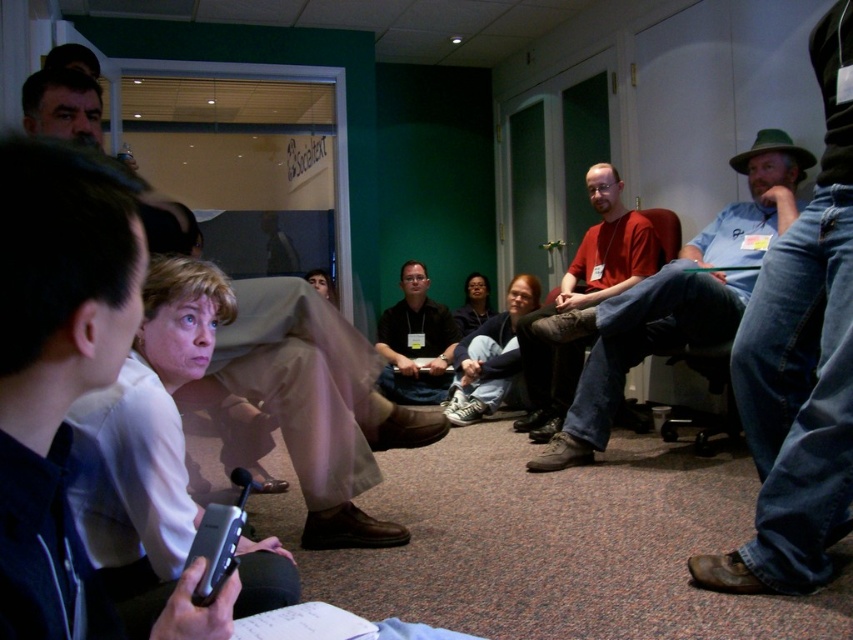
You are an attendee in the conference room and want to see the presenter at the front. Which attendee should you look past, the white fabric shirt at upper left or the red shirt at center?

You should look past the white fabric shirt at upper left because it is positioned under the red shirt at center, meaning the red shirt at center is in front.

You are an event planner trying to arrange name tags for attendees in the conference room. You need to place a name tag for the person wearing the white fabric shirt at upper left and another for the person wearing the blue jeans at lower right. Based on their positions in the image, which attendee is seated to the left of the other?

The white fabric shirt at upper left is positioned on the left side of blue jeans at lower right, so the attendee wearing the white fabric shirt at upper left is seated to the left of the one wearing the blue jeans at lower right.

You are an event organizer and need to arrange name tags for attendees. You have two shirts in your view, the white fabric shirt at upper left and the red shirt at center. Which shirt should you place a larger name tag on to ensure visibility?

The red shirt at center should receive a larger name tag since the white fabric shirt at upper left is smaller than the red shirt at center, making the larger shirt more suitable for visibility.